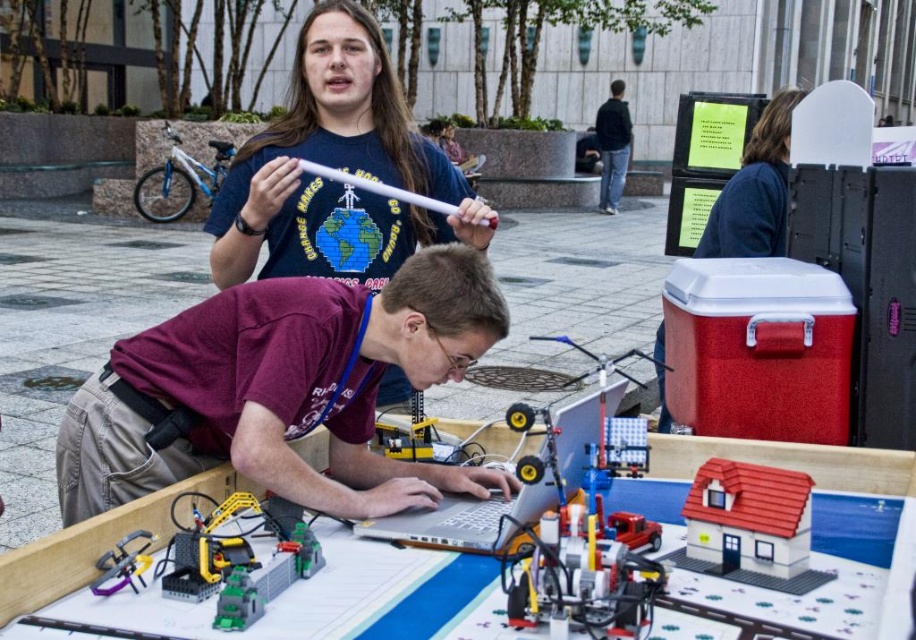
Is point (390, 204) positioned before point (540, 563)?

No, it is behind (540, 563).

Can you confirm if matte blue t-shirt at upper center is bigger than plastic toy house at center?

Indeed, matte blue t-shirt at upper center has a larger size compared to plastic toy house at center.

Which is in front, point (398, 216) or point (657, 582)?

Positioned in front is point (657, 582).

The width and height of the screenshot is (916, 640). In order to click on matte blue t-shirt at upper center in this screenshot , I will do 337,168.

Who is shorter, white plastic table at center or matte red cooler at upper right?

white plastic table at center

Which is below, white plastic table at center or matte red cooler at upper right?

white plastic table at center

Is point (675, 465) behind point (716, 212)?

That is False.

Find the location of a particular element. white plastic table at center is located at coordinates (808, 474).

Which is in front, point (509, 480) or point (680, 440)?

Point (509, 480) is more forward.

Which of these two, maroon shirt at center or white plastic table at center, stands shorter?

With less height is white plastic table at center.

Does point (187, 396) lie behind point (33, 573)?

That is True.

Image resolution: width=916 pixels, height=640 pixels. Find the location of `maroon shirt at center`. maroon shirt at center is located at coordinates (282, 388).